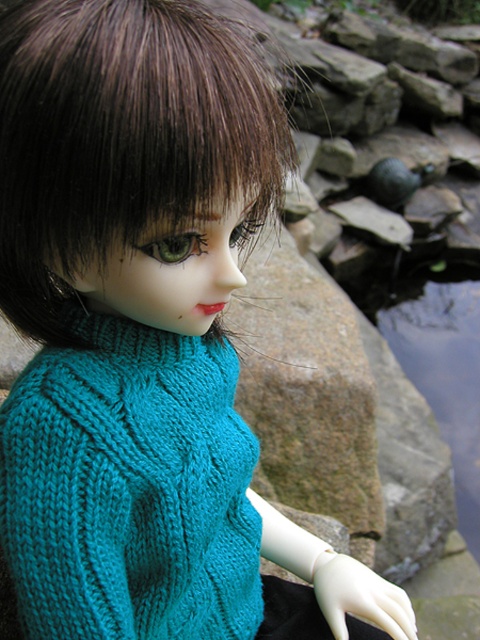
Question: Can you confirm if teal knitted sweater at center is wider than brownhair at center?

Choices:
 (A) yes
 (B) no

Answer: (B)

Question: Which point is farther to the camera?

Choices:
 (A) (214, 518)
 (B) (70, 344)

Answer: (A)

Question: Is teal knitted sweater at center positioned behind brownhair at center?

Choices:
 (A) yes
 (B) no

Answer: (A)

Question: Which point is farther to the camera?

Choices:
 (A) brownhair at center
 (B) teal knitted sweater at center

Answer: (B)

Question: Can you confirm if teal knitted sweater at center is positioned to the right of brownhair at center?

Choices:
 (A) no
 (B) yes

Answer: (B)